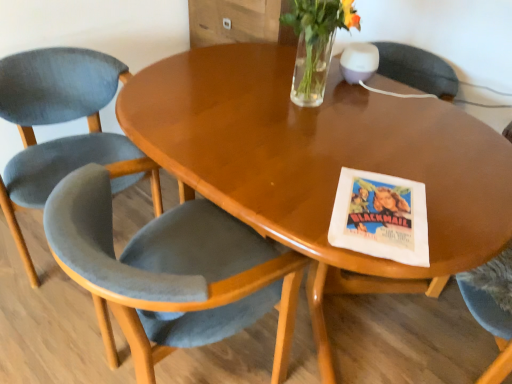
Question: Is velvet grey chair at lower left, marked as the 2th chair in a left-to-right arrangement, bigger than clear glass vase at upper center?

Choices:
 (A) yes
 (B) no

Answer: (A)

Question: Is velvet grey chair at lower left, the first chair viewed from the right, facing towards clear glass vase at upper center?

Choices:
 (A) yes
 (B) no

Answer: (B)

Question: From a real-world perspective, is velvet grey chair at lower left, marked as the 2th chair in a left-to-right arrangement, under clear glass vase at upper center?

Choices:
 (A) yes
 (B) no

Answer: (A)

Question: Is velvet grey chair at lower left, marked as the 2th chair in a left-to-right arrangement, positioned far away from clear glass vase at upper center?

Choices:
 (A) yes
 (B) no

Answer: (B)

Question: Is velvet grey chair at lower left, the first chair viewed from the right, positioned in front of clear glass vase at upper center?

Choices:
 (A) yes
 (B) no

Answer: (A)

Question: Considering the relative positions of velvet grey chair at lower left, the first chair viewed from the right, and clear glass vase at upper center in the image provided, is velvet grey chair at lower left, the first chair viewed from the right, to the right of clear glass vase at upper center from the viewer's perspective?

Choices:
 (A) no
 (B) yes

Answer: (A)

Question: Is velvet grey chair at left, the first chair positioned from the left, shorter than clear glass vase at upper center?

Choices:
 (A) yes
 (B) no

Answer: (B)

Question: Does velvet grey chair at left, the first chair positioned from the left, appear on the right side of clear glass vase at upper center?

Choices:
 (A) yes
 (B) no

Answer: (B)

Question: From the image's perspective, does velvet grey chair at left, which is counted as the 2th chair, starting from the right, appear higher than clear glass vase at upper center?

Choices:
 (A) yes
 (B) no

Answer: (B)

Question: Can you confirm if velvet grey chair at left, which is counted as the 2th chair, starting from the right, is wider than clear glass vase at upper center?

Choices:
 (A) yes
 (B) no

Answer: (A)

Question: Is velvet grey chair at left, which is counted as the 2th chair, starting from the right, not near clear glass vase at upper center?

Choices:
 (A) yes
 (B) no

Answer: (B)

Question: From a real-world perspective, is velvet grey chair at left, which is counted as the 2th chair, starting from the right, under clear glass vase at upper center?

Choices:
 (A) no
 (B) yes

Answer: (B)

Question: Can you confirm if velvet grey chair at lower left, the first chair viewed from the right, is positioned to the left of velvet grey chair at left, the first chair positioned from the left?

Choices:
 (A) no
 (B) yes

Answer: (A)